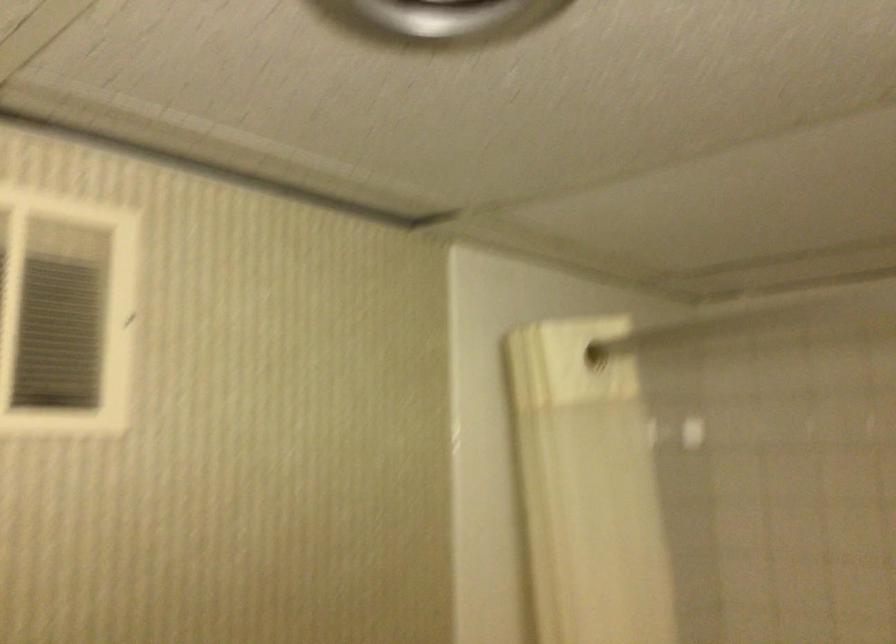
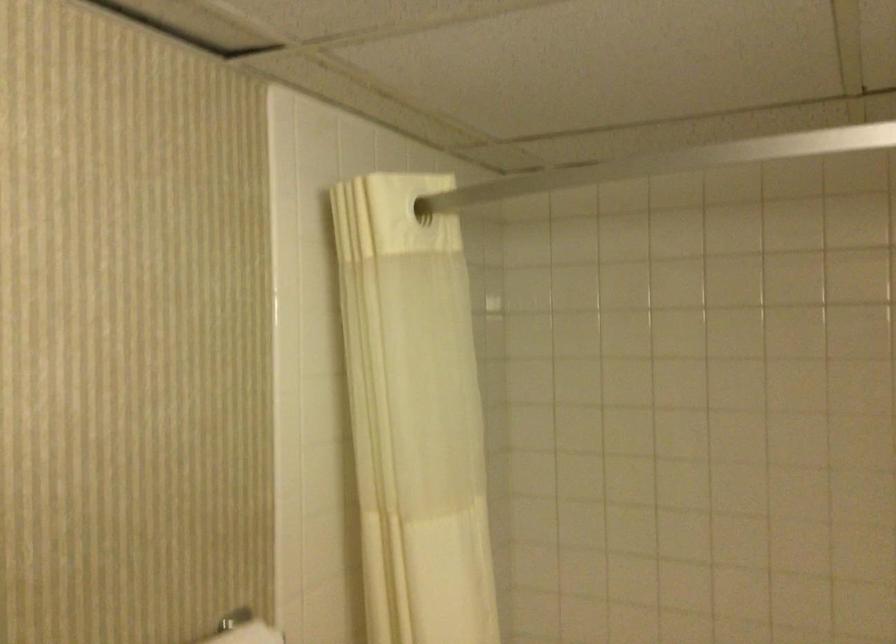
Question: The images are taken continuously from a first-person perspective. In which direction is your viewpoint rotating?

Choices:
 (A) Left
 (B) Right
 (C) Up
 (D) Down

Answer: (B)